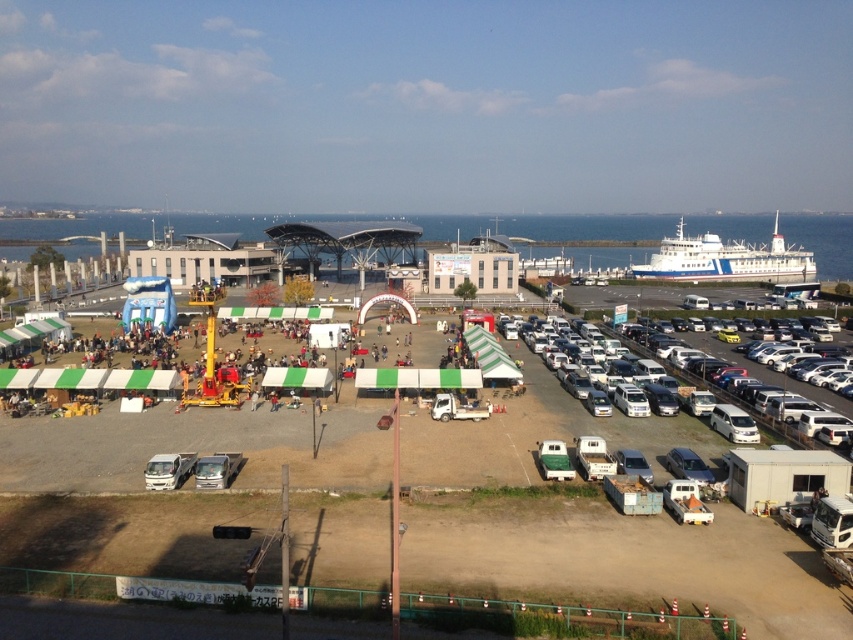
You are standing at the point marked as point (x=726, y=259) in the image. What object is located exactly at that point?

The blue polished ship at right is located exactly at point (x=726, y=259).

You are at the waterfront event and want to take a photo of both the blue polished ship at right and the white matte minivan at right. Since you can only stand in one spot, which object should you position yourself closer to in order to fit both in the frame?

You should position yourself closer to the white matte minivan at right because the blue polished ship at right is to the right of it, so by standing near the minivan, you can capture both objects in your photo frame.

You are standing at the point marked as point (726, 259) in the image. What object is located exactly at your current position?

The blue polished ship at right is located exactly at point (726, 259).